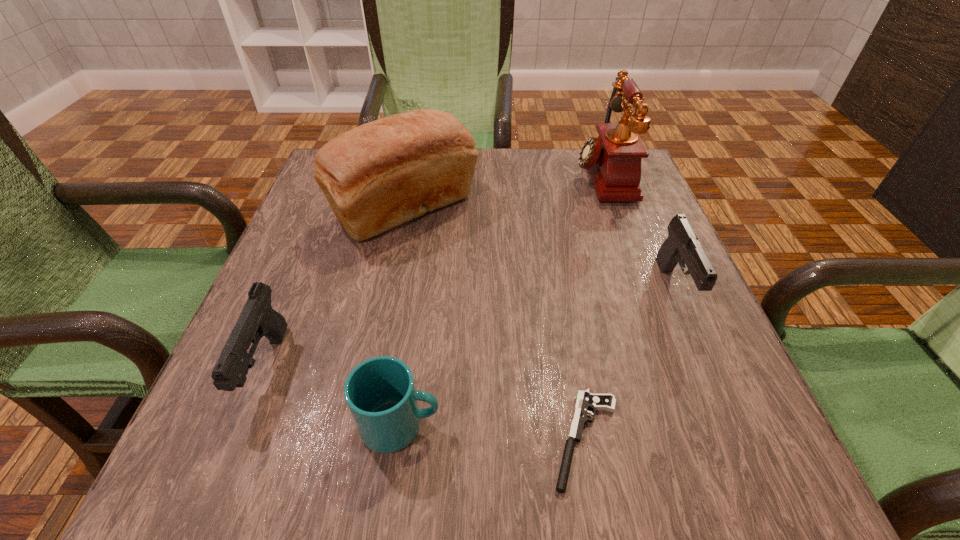
Identify the location of telephone. This screenshot has width=960, height=540. (613, 159).

Find the location of `bread`. bread is located at coordinates (379, 175).

At what (x,y) coordinates should I click in order to perform the action: click on the rightmost pistol. Please return your answer as a coordinate pair (x, y). Looking at the image, I should click on 682,246.

At what (x,y) coordinates should I click in order to perform the action: click on the third farthest object. Please return your answer as a coordinate pair (x, y). The width and height of the screenshot is (960, 540). Looking at the image, I should click on (682, 246).

You are a GUI agent. You are given a task and a screenshot of the screen. Output one action in this format:
    pyautogui.click(x=<x>, y=<y>)
    Task: Click on the leftmost pistol
    Image resolution: width=960 pixels, height=540 pixels.
    Given the screenshot: What is the action you would take?
    pyautogui.click(x=257, y=319)

Where is `cup`? The height and width of the screenshot is (540, 960). cup is located at coordinates (380, 392).

This screenshot has height=540, width=960. Find the location of `the second pistol from right to left`. the second pistol from right to left is located at coordinates (585, 400).

Where is `the fourth object from left to right`? The width and height of the screenshot is (960, 540). the fourth object from left to right is located at coordinates (585, 400).

I want to click on free space located 0.120m on the dial of the telephone, so click(527, 176).

Locate an element on the screen. Image resolution: width=960 pixels, height=540 pixels. free location located 0.240m on the dial of the telephone is located at coordinates (480, 176).